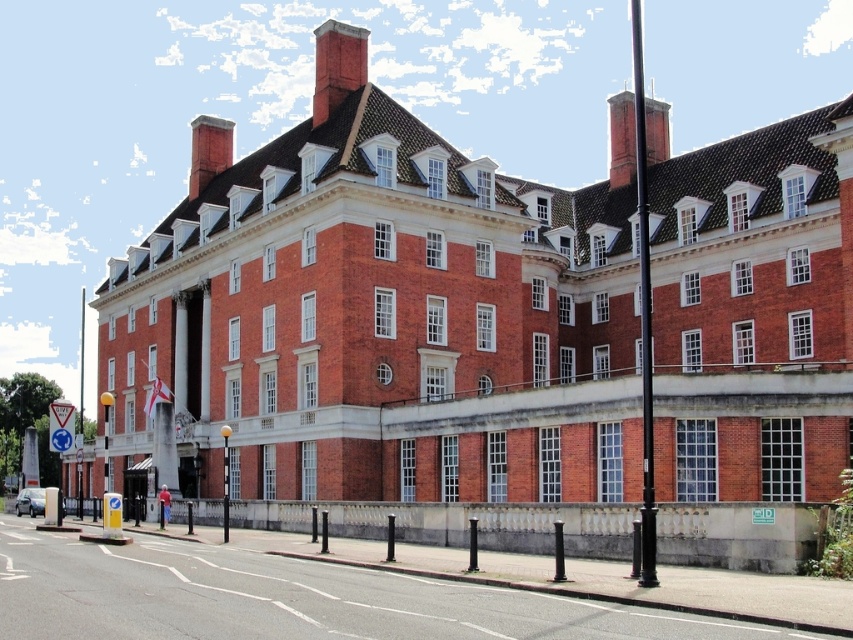
Question: Among these points, which one is farthest from the camera?

Choices:
 (A) (227, 150)
 (B) (322, 116)
 (C) (610, 113)

Answer: (C)

Question: Can you confirm if red brick chimney at upper center is positioned above smooth brick chimney at upper center?

Choices:
 (A) yes
 (B) no

Answer: (A)

Question: Does red brick chimney at upper center have a smaller size compared to smooth brick chimney at upper center?

Choices:
 (A) no
 (B) yes

Answer: (B)

Question: Which of the following is the closest to the observer?

Choices:
 (A) pos(190,193)
 (B) pos(358,65)

Answer: (B)

Question: Which object is closer to the camera taking this photo?

Choices:
 (A) red brick chimney at upper right
 (B) red brick chimney at upper center
 (C) smooth brick chimney at upper center

Answer: (B)

Question: From the image, what is the correct spatial relationship of red brick chimney at upper center in relation to red brick chimney at upper right?

Choices:
 (A) below
 (B) above

Answer: (B)